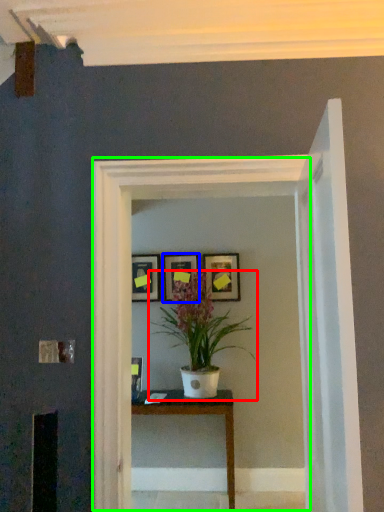
Question: Estimate the real-world distances between objects in this image. Which object is farther from houseplant (highlighted by a red box), picture frame (highlighted by a blue box) or glass door (highlighted by a green box)?

Choices:
 (A) picture frame
 (B) glass door

Answer: (B)